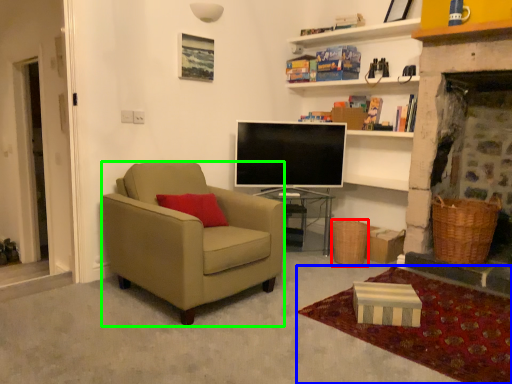
Question: Estimate the real-world distances between objects in this image. Which object is farther from picnic basket (highlighted by a red box), plain (highlighted by a blue box) or chair (highlighted by a green box)?

Choices:
 (A) plain
 (B) chair

Answer: (B)